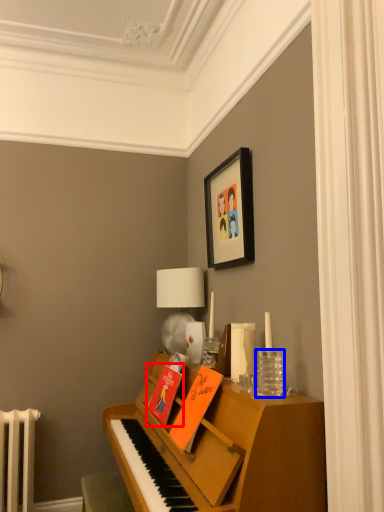
Question: Which of the following is the farthest to the observer, book (highlighted by a red box) or glass vase (highlighted by a blue box)?

Choices:
 (A) book
 (B) glass vase

Answer: (A)